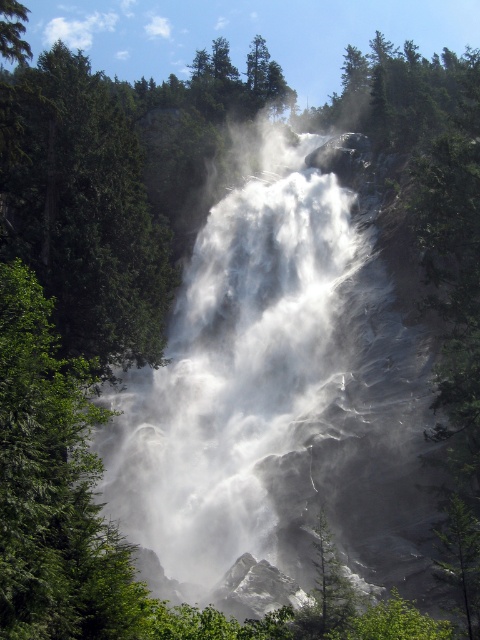
Question: Does green leafy tree at left have a smaller size compared to green matte tree at center?

Choices:
 (A) yes
 (B) no

Answer: (B)

Question: Is green leafy tree at left positioned before green matte tree at center?

Choices:
 (A) yes
 (B) no

Answer: (A)

Question: Where is green leafy tree at left located in relation to green matte tree at center in the image?

Choices:
 (A) above
 (B) below

Answer: (A)

Question: Which object appears closest to the camera in this image?

Choices:
 (A) green leafy tree at left
 (B) green matte tree at center

Answer: (A)

Question: Among these objects, which one is farthest from the camera?

Choices:
 (A) green matte tree at center
 (B) green leafy tree at left

Answer: (A)